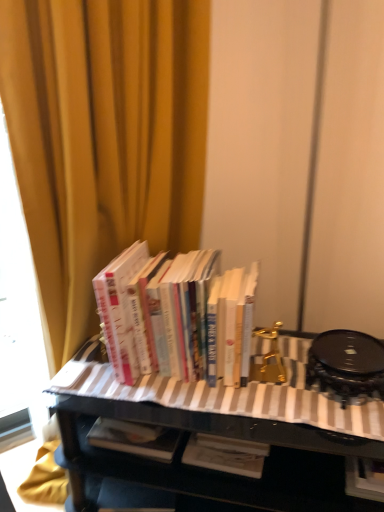
Question: From the image's perspective, is black glossy table at center on top of yellow fabric curtain at upper left?

Choices:
 (A) no
 (B) yes

Answer: (A)

Question: Considering the relative positions of black glossy table at center and yellow fabric curtain at upper left in the image provided, is black glossy table at center to the left of yellow fabric curtain at upper left from the viewer's perspective?

Choices:
 (A) yes
 (B) no

Answer: (B)

Question: Is black glossy table at center oriented away from yellow fabric curtain at upper left?

Choices:
 (A) yes
 (B) no

Answer: (A)

Question: Would you say black glossy table at center contains yellow fabric curtain at upper left?

Choices:
 (A) no
 (B) yes

Answer: (A)

Question: Is black glossy table at center beside yellow fabric curtain at upper left?

Choices:
 (A) yes
 (B) no

Answer: (B)

Question: Considering the positions of hardcover books at center and black glossy table at center in the image, is hardcover books at center taller or shorter than black glossy table at center?

Choices:
 (A) tall
 (B) short

Answer: (B)

Question: Considering the positions of hardcover books at center and black glossy table at center in the image, is hardcover books at center wider or thinner than black glossy table at center?

Choices:
 (A) wide
 (B) thin

Answer: (B)

Question: Looking at the image, does hardcover books at center seem bigger or smaller compared to black glossy table at center?

Choices:
 (A) small
 (B) big

Answer: (A)

Question: Based on their positions, is hardcover books at center located to the left or right of black glossy table at center?

Choices:
 (A) left
 (B) right

Answer: (A)

Question: Is yellow fabric curtain at upper left spatially inside black glossy table at center, or outside of it?

Choices:
 (A) outside
 (B) inside

Answer: (A)

Question: In the image, is yellow fabric curtain at upper left positioned in front of or behind black glossy table at center?

Choices:
 (A) behind
 (B) front

Answer: (B)

Question: Is point (97, 172) closer or farther from the camera than point (354, 440)?

Choices:
 (A) closer
 (B) farther

Answer: (B)

Question: In terms of width, does yellow fabric curtain at upper left look wider or thinner when compared to black glossy table at center?

Choices:
 (A) wide
 (B) thin

Answer: (B)

Question: Is point (183, 326) closer or farther from the camera than point (23, 121)?

Choices:
 (A) farther
 (B) closer

Answer: (A)

Question: In terms of width, does hardcover books at center look wider or thinner when compared to yellow fabric curtain at upper left?

Choices:
 (A) thin
 (B) wide

Answer: (A)